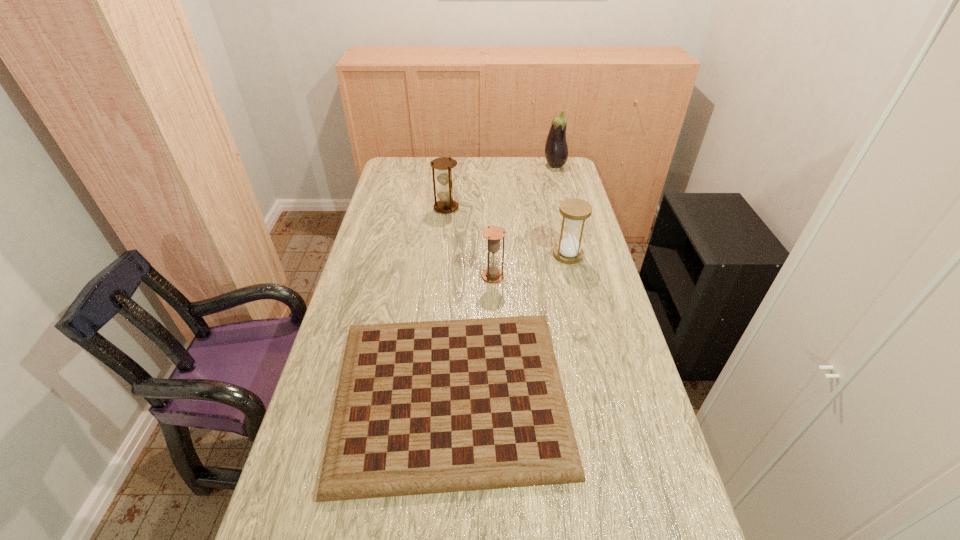
Where is `eggplant`? eggplant is located at coordinates pos(556,150).

Find the location of a particular element. Image resolution: width=960 pixels, height=540 pixels. the farthest object is located at coordinates (556, 150).

Where is `the leftmost hourglass`? the leftmost hourglass is located at coordinates (446, 204).

This screenshot has height=540, width=960. What are the coordinates of `the farthest hourglass` in the screenshot? It's located at click(446, 204).

Where is `the rightmost hourglass`? The width and height of the screenshot is (960, 540). the rightmost hourglass is located at coordinates (575, 211).

Find the location of a particular element. The width and height of the screenshot is (960, 540). the third farthest object is located at coordinates 575,211.

This screenshot has height=540, width=960. In order to click on the second hourglass from right to left in this screenshot , I will do `click(493, 234)`.

Locate an element on the screen. The width and height of the screenshot is (960, 540). the nearest hourglass is located at coordinates (493, 234).

The width and height of the screenshot is (960, 540). I want to click on the nearest object, so click(x=428, y=407).

This screenshot has height=540, width=960. What are the coordinates of `the shortest object` in the screenshot? It's located at (428, 407).